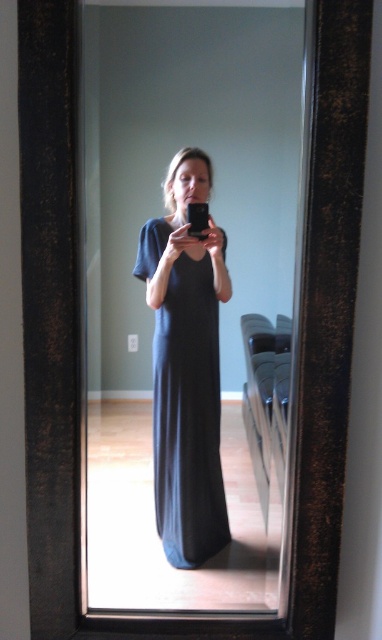
Is point (90, 428) positioned in front of point (173, 515)?

Yes, point (90, 428) is closer to viewer.

Does black matte dress at center have a lesser width compared to dark blue jersey dress at center?

In fact, black matte dress at center might be wider than dark blue jersey dress at center.

Does point (140, 413) come farther from viewer compared to point (166, 522)?

No, (140, 413) is in front of (166, 522).

You are a GUI agent. You are given a task and a screenshot of the screen. Output one action in this format:
    pyautogui.click(x=<x>, y=<y>)
    Task: Click on the black matte dress at center
    This screenshot has width=382, height=640.
    Given the screenshot: What is the action you would take?
    pyautogui.click(x=189, y=300)